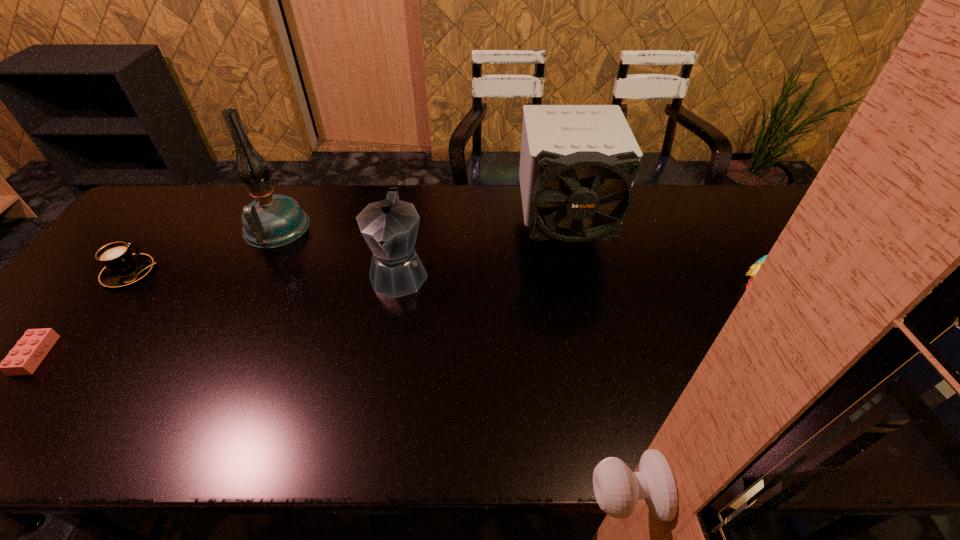
The height and width of the screenshot is (540, 960). In the image, there is a desktop. Find the location of `vacant space at the right edge`. vacant space at the right edge is located at coordinates (845, 298).

Where is `vacant space at the far right corner`? Image resolution: width=960 pixels, height=540 pixels. vacant space at the far right corner is located at coordinates (771, 212).

Find the location of a particular element. The height and width of the screenshot is (540, 960). vacant point located between the second shortest object and the coffeepot is located at coordinates (264, 273).

The height and width of the screenshot is (540, 960). I want to click on empty location between the fourth object from left to right and the rightmost object, so click(600, 286).

Find the location of a particular element. empty space between the fan and the coffeepot is located at coordinates (481, 251).

Where is `vacant space that is in between the Lego and the coffeepot`? This screenshot has height=540, width=960. vacant space that is in between the Lego and the coffeepot is located at coordinates (217, 314).

Locate an element on the screen. Image resolution: width=960 pixels, height=540 pixels. free space that is in between the second shortest object and the Lego is located at coordinates (83, 314).

Where is `free space between the Lego and the rightmost object`? The width and height of the screenshot is (960, 540). free space between the Lego and the rightmost object is located at coordinates (418, 327).

Identify the location of vacant area that lies between the second shortest object and the oil lamp. The height and width of the screenshot is (540, 960). (203, 251).

Find the location of a particular element. unoccupied position between the cake and the fifth tallest object is located at coordinates coord(465,286).